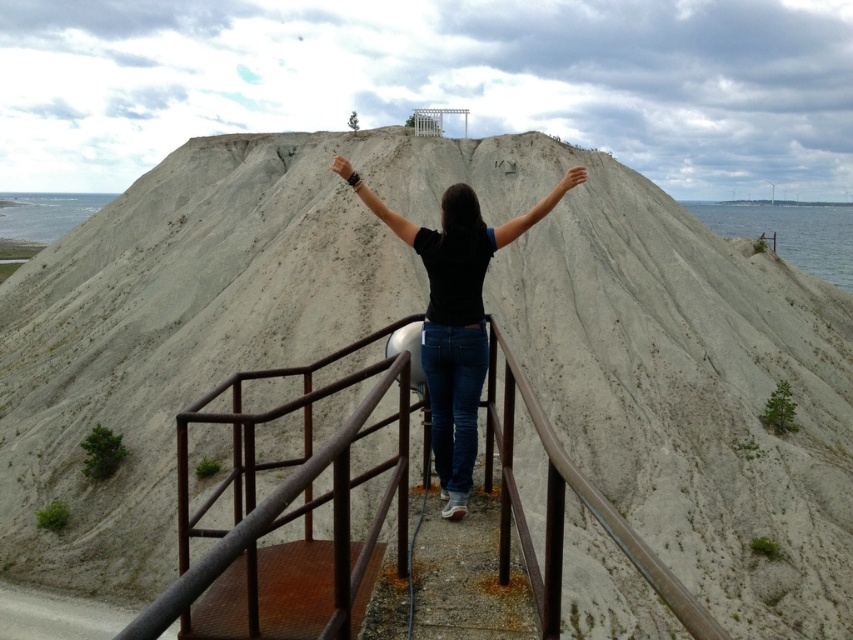
You are a photographer trying to capture the person at the top of the sandy hill. You notice the black matte arm at center and the light skin hand at upper center. Which object is bigger in the photo?

The black matte arm at center is larger in size compared to the light skin hand at upper center.